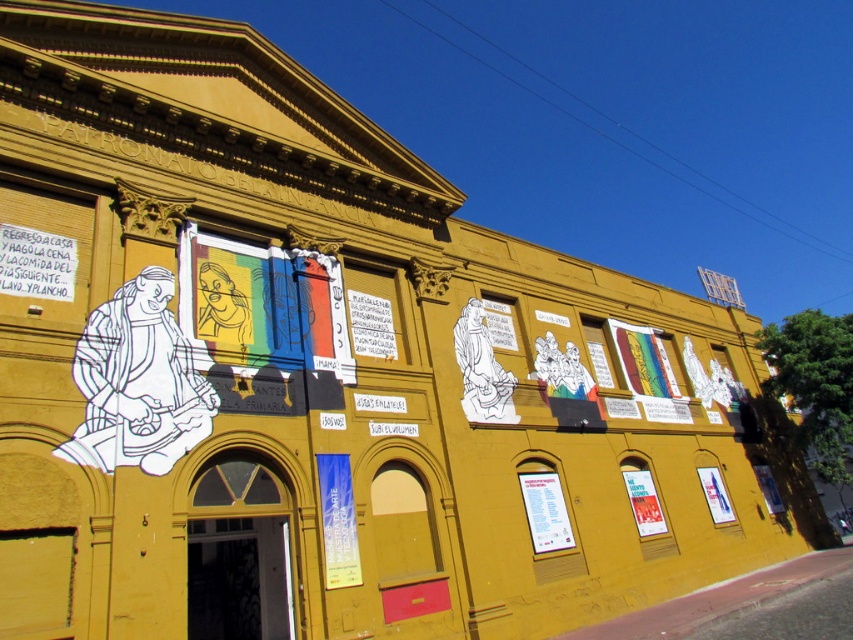
Question: Which of these objects is positioned farthest from the blue fabric banner at center?

Choices:
 (A) white paper poster at upper left
 (B) matte white poster at lower right

Answer: (B)

Question: Is blue fabric banner at center positioned at the back of matte white poster at lower right?

Choices:
 (A) yes
 (B) no

Answer: (B)

Question: Estimate the real-world distances between objects in this image. Which object is farther from the matte paper poster at lower right?

Choices:
 (A) matte white poster at lower right
 (B) white paper poster at center
 (C) blue fabric banner at center
 (D) white paper poster at upper left

Answer: (D)

Question: Estimate the real-world distances between objects in this image. Which object is farther from the blue fabric banner at center?

Choices:
 (A) matte white poster at lower right
 (B) white paper poster at center

Answer: (A)

Question: Is blue fabric banner at center closer to the viewer compared to matte white poster at lower right?

Choices:
 (A) no
 (B) yes

Answer: (B)

Question: Does blue fabric banner at center have a lesser width compared to white paper poster at center?

Choices:
 (A) no
 (B) yes

Answer: (B)